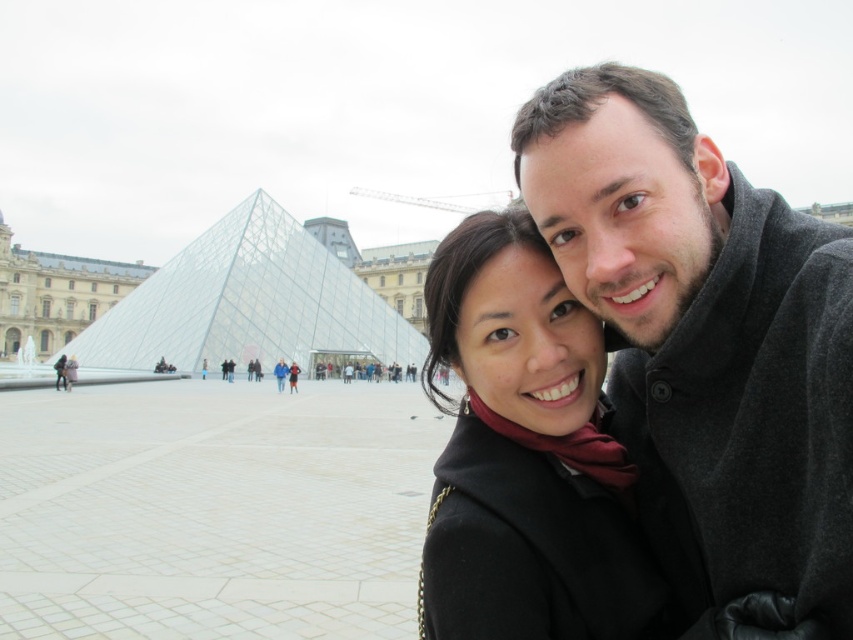
Question: Which point appears closest to the camera in this image?

Choices:
 (A) (480, 234)
 (B) (723, 236)
 (C) (94, 342)

Answer: (B)

Question: Is dark gray wool coat at upper right thinner than transparent glass pyramid at center?

Choices:
 (A) yes
 (B) no

Answer: (A)

Question: Is dark gray wool coat at upper right positioned in front of black matte coat at center?

Choices:
 (A) no
 (B) yes

Answer: (B)

Question: Is black matte coat at center thinner than transparent glass pyramid at center?

Choices:
 (A) yes
 (B) no

Answer: (A)

Question: Which point is farther to the camera?

Choices:
 (A) (267, 269)
 (B) (666, 241)

Answer: (A)

Question: Which of these objects is positioned closest to the black matte coat at center?

Choices:
 (A) dark gray wool coat at upper right
 (B) transparent glass pyramid at center

Answer: (A)